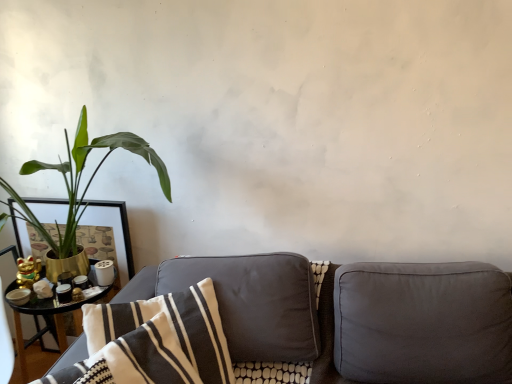
Question: Is suede gray couch at lower center looking in the opposite direction of suede-like gray pillow at right, acting as the first pillow starting from the right?

Choices:
 (A) yes
 (B) no

Answer: (A)

Question: Does suede gray couch at lower center have a lesser height compared to suede-like gray pillow at right, which ranks as the 2th pillow in left-to-right order?

Choices:
 (A) no
 (B) yes

Answer: (A)

Question: Is suede gray couch at lower center taller than suede-like gray pillow at right, which ranks as the 2th pillow in left-to-right order?

Choices:
 (A) yes
 (B) no

Answer: (A)

Question: From a real-world perspective, is suede gray couch at lower center over suede-like gray pillow at right, which ranks as the 2th pillow in left-to-right order?

Choices:
 (A) no
 (B) yes

Answer: (A)

Question: Are suede gray couch at lower center and suede-like gray pillow at right, which ranks as the 2th pillow in left-to-right order, beside each other?

Choices:
 (A) yes
 (B) no

Answer: (A)

Question: Is suede gray couch at lower center in front of or behind suede-like gray pillow at right, which ranks as the 2th pillow in left-to-right order, in the image?

Choices:
 (A) front
 (B) behind

Answer: (A)

Question: Is suede gray couch at lower center taller or shorter than suede-like gray pillow at right, which ranks as the 2th pillow in left-to-right order?

Choices:
 (A) tall
 (B) short

Answer: (A)

Question: Do you think suede gray couch at lower center is within suede-like gray pillow at right, which ranks as the 2th pillow in left-to-right order, or outside of it?

Choices:
 (A) outside
 (B) inside

Answer: (B)

Question: Considering the positions of point (331, 301) and point (352, 357), is point (331, 301) closer or farther from the camera than point (352, 357)?

Choices:
 (A) closer
 (B) farther

Answer: (B)

Question: From a real-world perspective, is suede-like gray pillow at right, acting as the first pillow starting from the right, positioned above or below matte black picture frame at left?

Choices:
 (A) above
 (B) below

Answer: (B)

Question: Choose the correct answer: Is suede-like gray pillow at right, which ranks as the 2th pillow in left-to-right order, inside matte black picture frame at left or outside it?

Choices:
 (A) outside
 (B) inside

Answer: (A)

Question: Does point (458, 372) appear closer or farther from the camera than point (27, 241)?

Choices:
 (A) farther
 (B) closer

Answer: (B)

Question: Is suede-like gray pillow at right, which ranks as the 2th pillow in left-to-right order, to the left or to the right of matte black picture frame at left in the image?

Choices:
 (A) left
 (B) right

Answer: (B)

Question: Is white striped fabric pillow at center, acting as the first pillow starting from the left, bigger or smaller than suede gray couch at lower center?

Choices:
 (A) small
 (B) big

Answer: (A)

Question: From the image's perspective, relative to suede gray couch at lower center, is white striped fabric pillow at center, positioned as the second pillow in right-to-left order, above or below?

Choices:
 (A) above
 (B) below

Answer: (A)